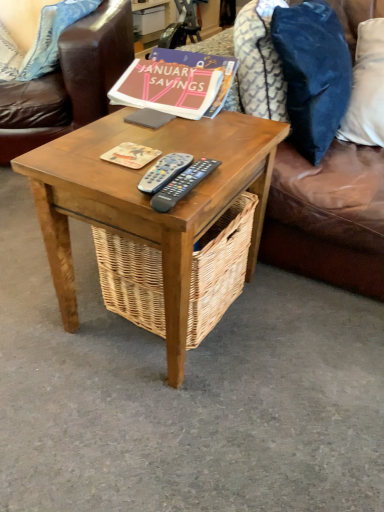
Question: Does matte cardboard coaster at center, which is the first book in bottom-to-top order, have a lesser height compared to blue fabric pillow at upper left, the 3th pillow from the right?

Choices:
 (A) yes
 (B) no

Answer: (A)

Question: Does matte cardboard coaster at center, which is the 1th book from front to back, have a larger size compared to blue fabric pillow at upper left, the 3th pillow from the right?

Choices:
 (A) no
 (B) yes

Answer: (A)

Question: Is matte cardboard coaster at center, acting as the second book starting from the top, facing away from blue fabric pillow at upper left, the 3th pillow from the right?

Choices:
 (A) yes
 (B) no

Answer: (B)

Question: From the image's perspective, does matte cardboard coaster at center, acting as the second book starting from the top, appear lower than blue fabric pillow at upper left, the 3th pillow from the right?

Choices:
 (A) yes
 (B) no

Answer: (A)

Question: From the image's perspective, is matte cardboard coaster at center, the 2th book from the back, over blue fabric pillow at upper left, the 3th pillow from the right?

Choices:
 (A) no
 (B) yes

Answer: (A)

Question: Looking at their shapes, would you say blue fabric pillow at upper left, positioned as the 2th pillow in left-to-right order, is wider or thinner than velvety blue pillow at upper right, the 4th pillow when ordered from left to right?

Choices:
 (A) wide
 (B) thin

Answer: (B)

Question: Looking at the image, does blue fabric pillow at upper left, positioned as the 2th pillow in left-to-right order, seem bigger or smaller compared to velvety blue pillow at upper right, which is counted as the 1th pillow, starting from the right?

Choices:
 (A) big
 (B) small

Answer: (A)

Question: Does point (23, 64) appear closer or farther from the camera than point (354, 113)?

Choices:
 (A) closer
 (B) farther

Answer: (B)

Question: Visually, is blue fabric pillow at upper left, positioned as the 2th pillow in left-to-right order, positioned to the left or to the right of velvety blue pillow at upper right, the 4th pillow when ordered from left to right?

Choices:
 (A) right
 (B) left

Answer: (B)

Question: In terms of width, does matte cardboard coaster at center, which is the first book in bottom-to-top order, look wider or thinner when compared to velvety blue pillow at upper right, positioned as the second pillow in right-to-left order?

Choices:
 (A) wide
 (B) thin

Answer: (B)

Question: From a real-world perspective, is matte cardboard coaster at center, which is the 1th book from front to back, above or below velvety blue pillow at upper right, placed as the 3th pillow when sorted from left to right?

Choices:
 (A) above
 (B) below

Answer: (B)

Question: Considering the positions of matte cardboard coaster at center, which is the first book in bottom-to-top order, and velvety blue pillow at upper right, placed as the 3th pillow when sorted from left to right, in the image, is matte cardboard coaster at center, which is the first book in bottom-to-top order, bigger or smaller than velvety blue pillow at upper right, placed as the 3th pillow when sorted from left to right,?

Choices:
 (A) big
 (B) small

Answer: (B)

Question: Visually, is matte cardboard coaster at center, the 2th book from the back, positioned to the left or to the right of velvety blue pillow at upper right, placed as the 3th pillow when sorted from left to right?

Choices:
 (A) left
 (B) right

Answer: (A)

Question: From the image's perspective, is brown leather couch at upper right above or below blue fabric pillow at upper left, the first pillow in the left-to-right sequence?

Choices:
 (A) below
 (B) above

Answer: (A)

Question: In the image, is brown leather couch at upper right positioned in front of or behind blue fabric pillow at upper left, the fourth pillow in the right-to-left sequence?

Choices:
 (A) behind
 (B) front

Answer: (B)